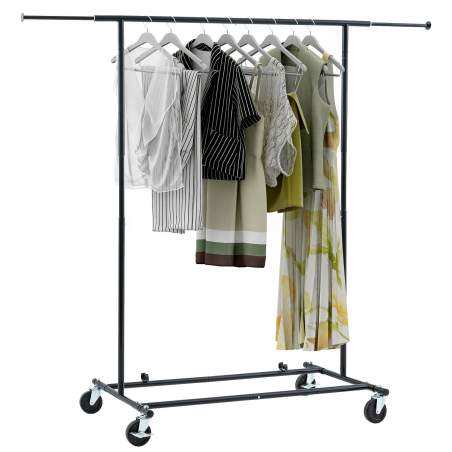
Locate an element on the screen. clothes hangers is located at coordinates (145, 39), (168, 37), (204, 39), (225, 41), (246, 40), (272, 39), (293, 38), (312, 38).